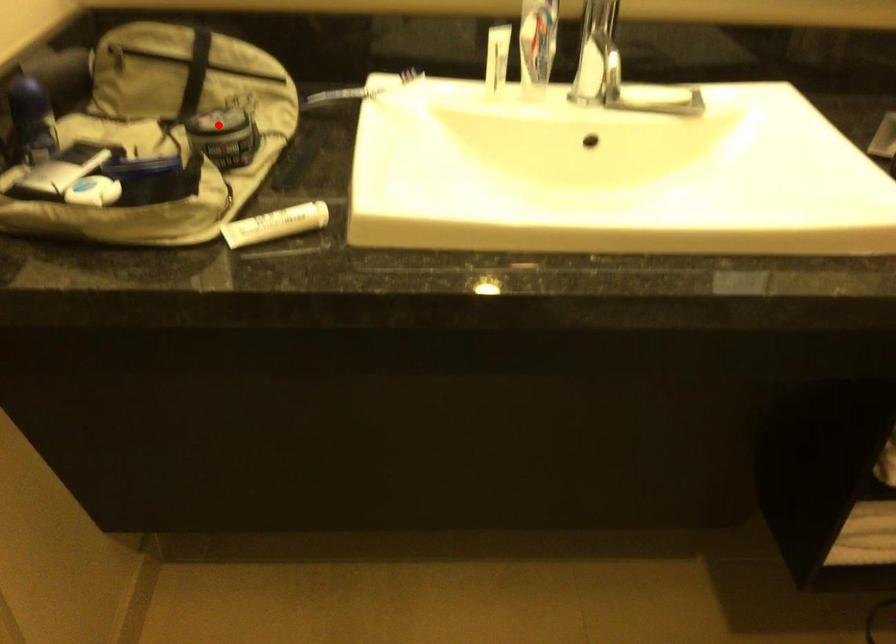
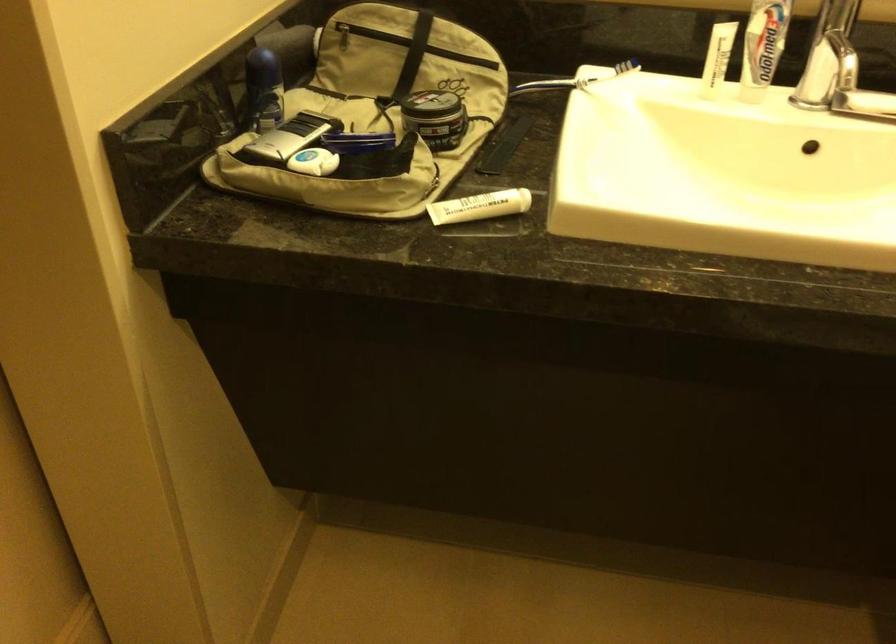
The point at the highlighted location is marked in the first image. Where is the corresponding point in the second image?

(433, 105)